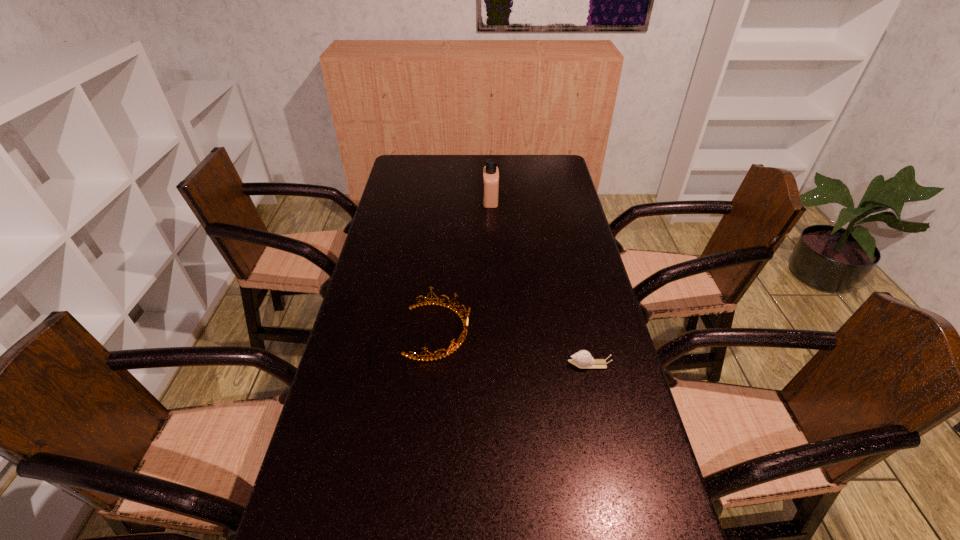
Find the location of a particular element. The height and width of the screenshot is (540, 960). unoccupied position between the second tallest object and the second object from left to right is located at coordinates (465, 266).

What are the coordinates of `free space between the leftmost object and the tallest object` in the screenshot? It's located at click(x=465, y=266).

What are the coordinates of `free space between the second object from left to right and the second tallest object` in the screenshot? It's located at (465, 266).

The width and height of the screenshot is (960, 540). I want to click on free spot between the tallest object and the shortest object, so click(540, 282).

Identify the location of free space between the farthest object and the rightmost object. The width and height of the screenshot is (960, 540). (540, 282).

In order to click on empty space between the tallest object and the leftmost object in this screenshot , I will do `click(465, 266)`.

Find the location of a particular element. This screenshot has width=960, height=540. vacant area between the perfume and the escargot is located at coordinates (540, 282).

Where is `free space that is in between the shortest object and the second shortest object`? Image resolution: width=960 pixels, height=540 pixels. free space that is in between the shortest object and the second shortest object is located at coordinates (514, 348).

Where is `vacant area between the farthest object and the second shortest object`? This screenshot has height=540, width=960. vacant area between the farthest object and the second shortest object is located at coordinates (465, 266).

Where is `object that is the second closest to the tallest object`? The height and width of the screenshot is (540, 960). object that is the second closest to the tallest object is located at coordinates (582, 359).